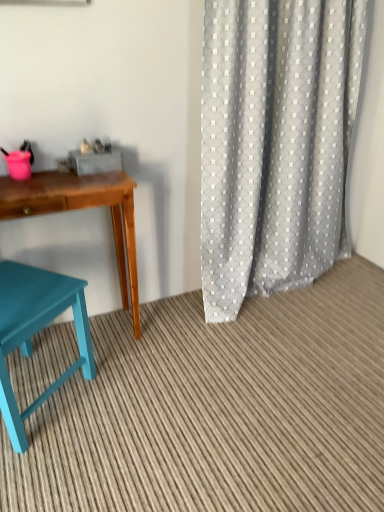
Question: Considering the relative positions of teal wood stool at lower left and teal wood desk at left in the image provided, is teal wood stool at lower left in front of teal wood desk at left?

Choices:
 (A) yes
 (B) no

Answer: (A)

Question: Does teal wood stool at lower left have a greater height compared to teal wood desk at left?

Choices:
 (A) yes
 (B) no

Answer: (B)

Question: Is teal wood stool at lower left aimed at teal wood desk at left?

Choices:
 (A) no
 (B) yes

Answer: (A)

Question: Considering the relative sizes of teal wood stool at lower left and teal wood desk at left in the image provided, is teal wood stool at lower left wider than teal wood desk at left?

Choices:
 (A) no
 (B) yes

Answer: (B)

Question: Is teal wood stool at lower left to the left of teal wood desk at left from the viewer's perspective?

Choices:
 (A) yes
 (B) no

Answer: (B)

Question: In the image, is gray textured curtain at right on the left side or the right side of teal painted wood chair at lower left?

Choices:
 (A) left
 (B) right

Answer: (B)

Question: From the image's perspective, is gray textured curtain at right positioned above or below teal painted wood chair at lower left?

Choices:
 (A) above
 (B) below

Answer: (A)

Question: Looking at their shapes, would you say gray textured curtain at right is wider or thinner than teal painted wood chair at lower left?

Choices:
 (A) thin
 (B) wide

Answer: (A)

Question: Based on their sizes in the image, would you say gray textured curtain at right is bigger or smaller than teal painted wood chair at lower left?

Choices:
 (A) small
 (B) big

Answer: (B)

Question: Considering the positions of teal painted wood chair at lower left and teal wood stool at lower left in the image, is teal painted wood chair at lower left taller or shorter than teal wood stool at lower left?

Choices:
 (A) short
 (B) tall

Answer: (B)

Question: From a real-world perspective, is teal painted wood chair at lower left above or below teal wood stool at lower left?

Choices:
 (A) below
 (B) above

Answer: (B)

Question: Looking at their shapes, would you say teal painted wood chair at lower left is wider or thinner than teal wood stool at lower left?

Choices:
 (A) thin
 (B) wide

Answer: (A)

Question: Is teal painted wood chair at lower left inside or outside of teal wood stool at lower left?

Choices:
 (A) inside
 (B) outside

Answer: (B)

Question: From the image's perspective, relative to teal painted wood chair at lower left, is teal wood stool at lower left above or below?

Choices:
 (A) above
 (B) below

Answer: (B)

Question: In terms of size, does teal wood stool at lower left appear bigger or smaller than teal painted wood chair at lower left?

Choices:
 (A) big
 (B) small

Answer: (B)